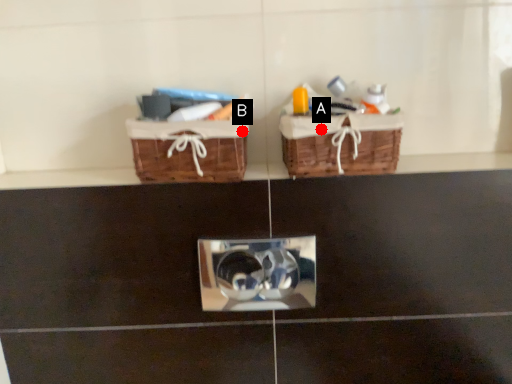
Question: Two points are circled on the image, labeled by A and B beside each circle. Among these points, which one is farthest from the camera?

Choices:
 (A) A is further
 (B) B is further

Answer: (B)